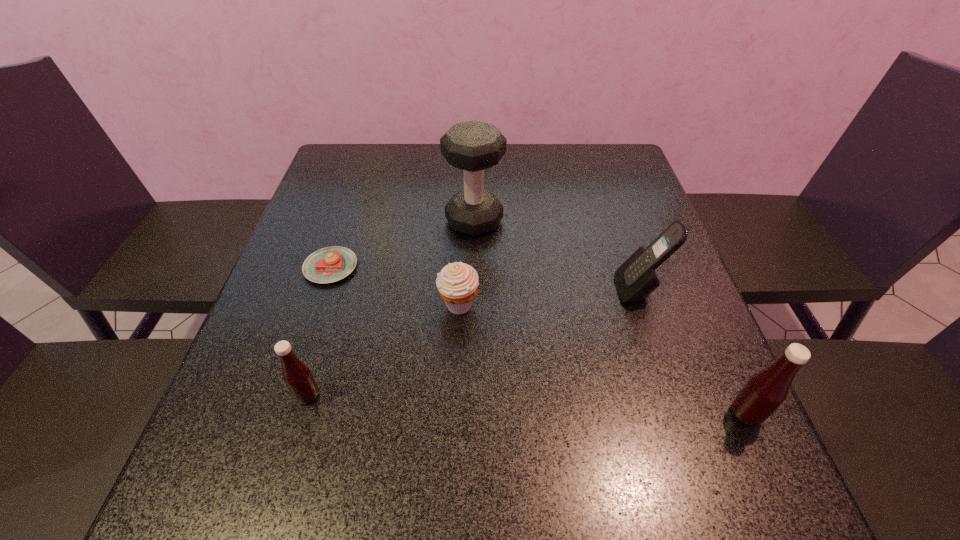
At what (x,y) coordinates should I click in order to perform the action: click on free point located 0.070m on the back of the rightmost object. Please return your answer as a coordinate pair (x, y). Looking at the image, I should click on (724, 365).

Locate an element on the screen. The width and height of the screenshot is (960, 540). vacant point located on the right of the pastry is located at coordinates (507, 267).

Identify the location of vacant position located 0.090m on the left of the dumbbell. The width and height of the screenshot is (960, 540). (410, 221).

Locate an element on the screen. The image size is (960, 540). vacant space located on the front-facing side of the fifth object from left to right is located at coordinates (449, 290).

Locate an element on the screen. vacant space located on the front-facing side of the fifth object from left to right is located at coordinates (570, 290).

This screenshot has width=960, height=540. Identify the location of vacant space positioned on the front-facing side of the fifth object from left to right. (593, 290).

The image size is (960, 540). I want to click on vacant space located 0.360m on the back of the fifth tallest object, so click(464, 192).

Locate an element on the screen. The width and height of the screenshot is (960, 540). Tabasco sauce situated at the left edge is located at coordinates (297, 376).

Image resolution: width=960 pixels, height=540 pixels. In order to click on pastry that is at the left edge in this screenshot , I will do `click(330, 264)`.

Locate an element on the screen. The image size is (960, 540). Tabasco sauce present at the right edge is located at coordinates (766, 390).